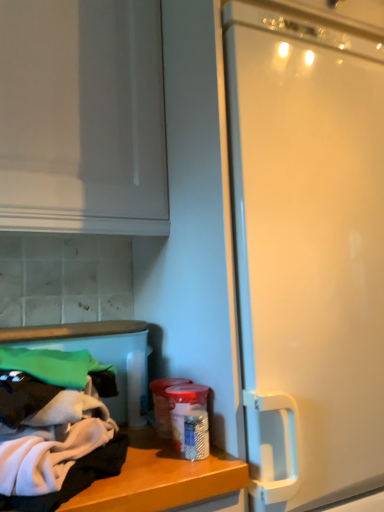
Question: Based on their positions, is translucent plastic container at lower center located to the left or right of white soft cloth at lower left?

Choices:
 (A) left
 (B) right

Answer: (B)

Question: From the image's perspective, is translucent plastic container at lower center positioned above or below white soft cloth at lower left?

Choices:
 (A) above
 (B) below

Answer: (B)

Question: Considering the positions of translucent plastic container at lower center and white soft cloth at lower left in the image, is translucent plastic container at lower center taller or shorter than white soft cloth at lower left?

Choices:
 (A) short
 (B) tall

Answer: (B)

Question: Is white soft cloth at lower left inside the boundaries of translucent plastic container at lower center, or outside?

Choices:
 (A) outside
 (B) inside

Answer: (A)

Question: Is white soft cloth at lower left in front of or behind translucent plastic container at lower center in the image?

Choices:
 (A) front
 (B) behind

Answer: (A)

Question: From a real-world perspective, relative to translucent plastic container at lower center, is white soft cloth at lower left vertically above or below?

Choices:
 (A) above
 (B) below

Answer: (A)

Question: Based on their positions, is white soft cloth at lower left located to the left or right of translucent plastic container at lower center?

Choices:
 (A) left
 (B) right

Answer: (A)